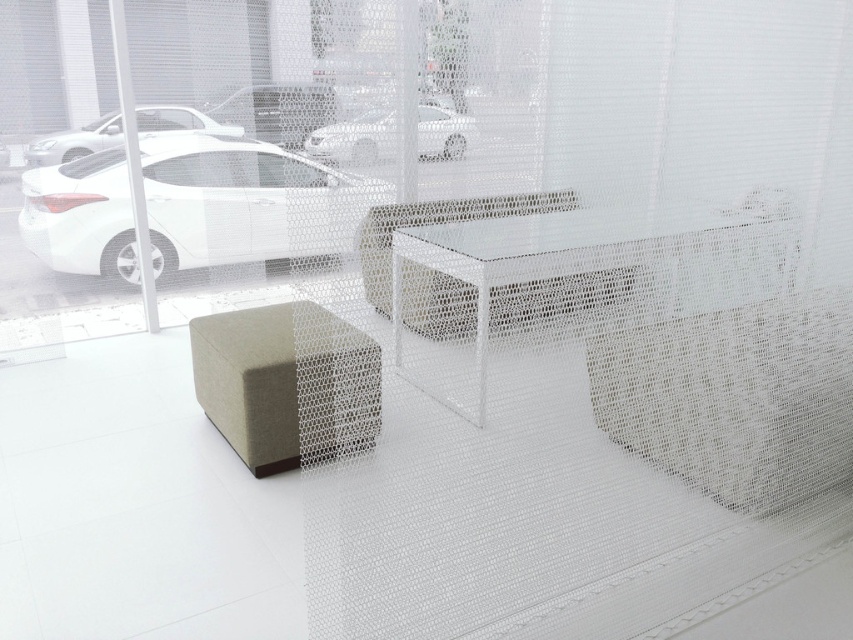
Consider the image. You are standing in the room and want to place a decorative vase on the white mesh table at center. Based on its position, where exactly should you aim to place the vase?

The white mesh table at center is located at coordinates point (564, 276), so you should aim for that exact position to place the vase.

Based on the photo, you are a delivery person trying to place a package on the white mesh table at center. However, there is a white glossy car at upper left parked nearby. Can you place the package on the table without moving the car?

The white mesh table at center is much taller than the white glossy car at upper left, so the package can be placed on the table without needing to move the car as the car is shorter.

You are standing in the minimalist interior space and want to place a new decorative item on the floor. The new item requires a clear space of 0.5 meters in diameter. Based on the scene description, can you determine if there is enough space between the table and the textured beige stool at center to accommodate the new item?

The textured beige stool at center is located at point [286,384]. However, without knowing the exact dimensions and positioning of the table and the required distance between them, it is impossible to determine if there is sufficient space for the new item.